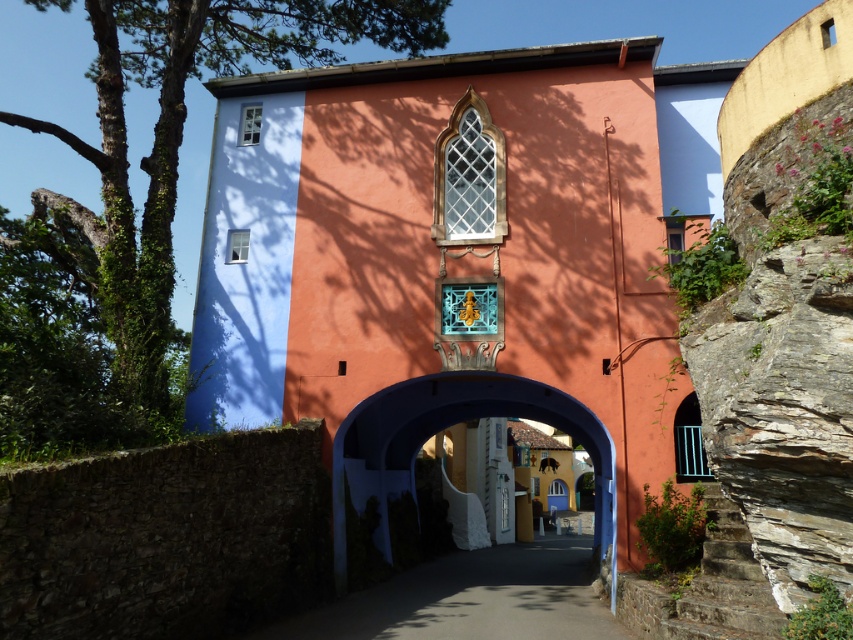
You are standing in front of the building and notice the brown stone wall at lower left and the green leafy tree at upper left. Which object is positioned higher in the image?

The green leafy tree at upper left is positioned higher in the image than the brown stone wall at lower left.

You are standing in front of the building and see a point marked at coordinates [183,129]. Based on the scene description, where is this point located?

The point is located on the green leafy tree at upper left.

You are standing in front of the building and notice two points marked on the structure. The first point is at coordinates point (x=161, y=192), and the second is at point (x=457, y=381). Which of these points is closer to you?

Point (x=161, y=192) is in front of point (x=457, y=381), so the first point is closer to you.